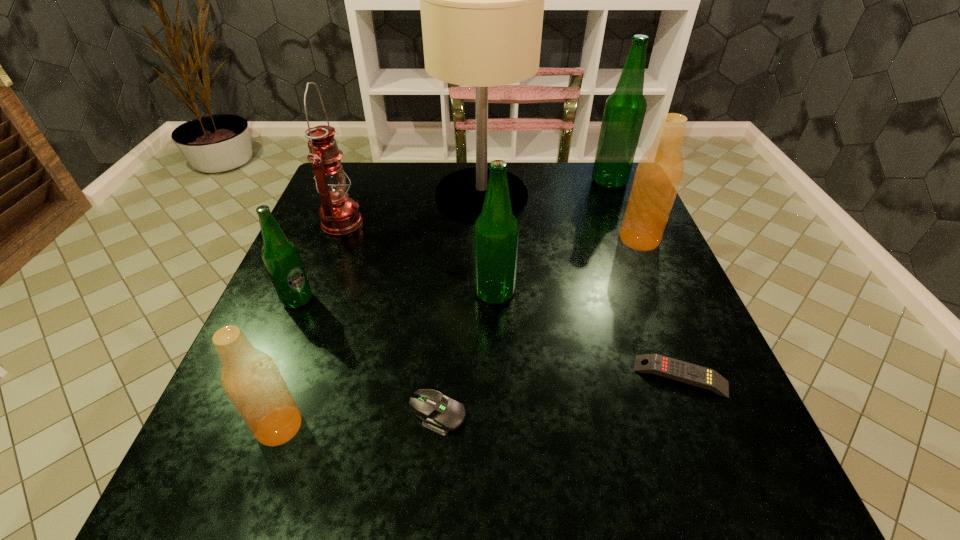
You are a GUI agent. You are given a task and a screenshot of the screen. Output one action in this format:
    pyautogui.click(x=<x>, y=<y>)
    Task: Click on the nearer tan beer bottle
    This screenshot has width=960, height=540.
    Given the screenshot: What is the action you would take?
    pyautogui.click(x=250, y=378)

I want to click on the left tan beer bottle, so click(250, 378).

Where is `gray computer mouse`? gray computer mouse is located at coordinates (442, 413).

At what (x,y) coordinates should I click in order to perform the action: click on yellow remote control. Please return your answer as a coordinate pair (x, y). The image size is (960, 540). Looking at the image, I should click on (685, 372).

You are a GUI agent. You are given a task and a screenshot of the screen. Output one action in this format:
    pyautogui.click(x=<x>, y=<y>)
    Task: Click on the shortest object
    
    Given the screenshot: What is the action you would take?
    pyautogui.click(x=685, y=372)

Locate an element on the screen. Image resolution: width=960 pixels, height=540 pixels. blank area located 0.220m on the left of the tallest object is located at coordinates (353, 195).

Find the location of a particular element. vacant space located on the label of the farthest beer bottle is located at coordinates (460, 181).

Locate an element on the screen. This screenshot has height=540, width=960. vacant space located 0.400m on the label of the farthest beer bottle is located at coordinates (449, 181).

I want to click on free space located on the label of the farthest beer bottle, so click(488, 181).

At what (x,y) coordinates should I click in order to perform the action: click on free spot located on the front of the oil lamp. Please return your answer as a coordinate pair (x, y). Looking at the image, I should click on (278, 389).